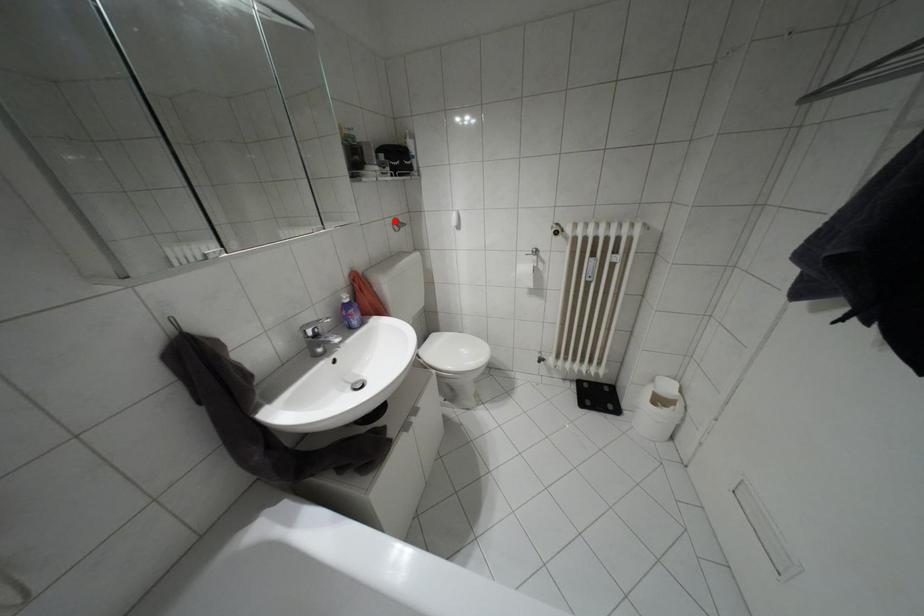
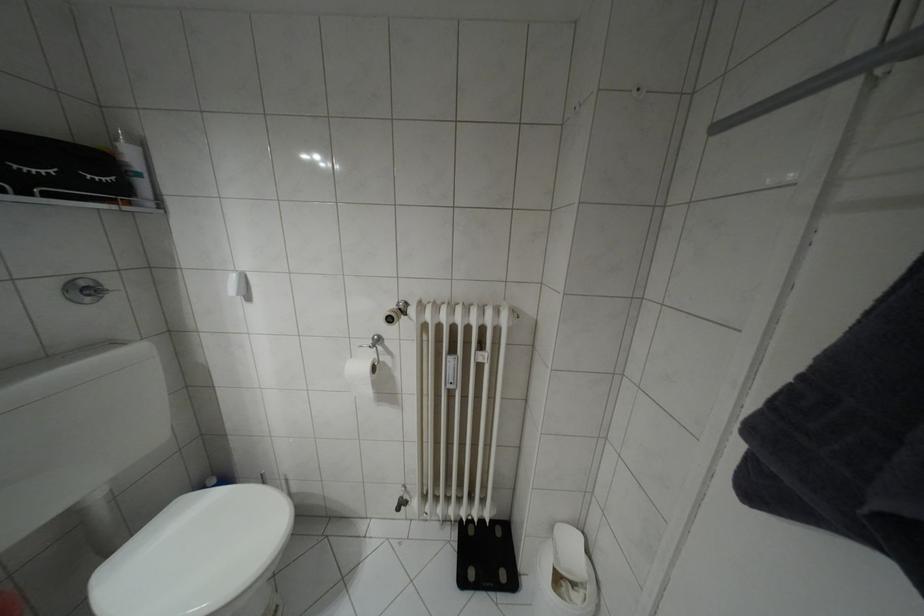
Where in the second image is the point corresponding to the highlighted location from the first image?

(81, 284)